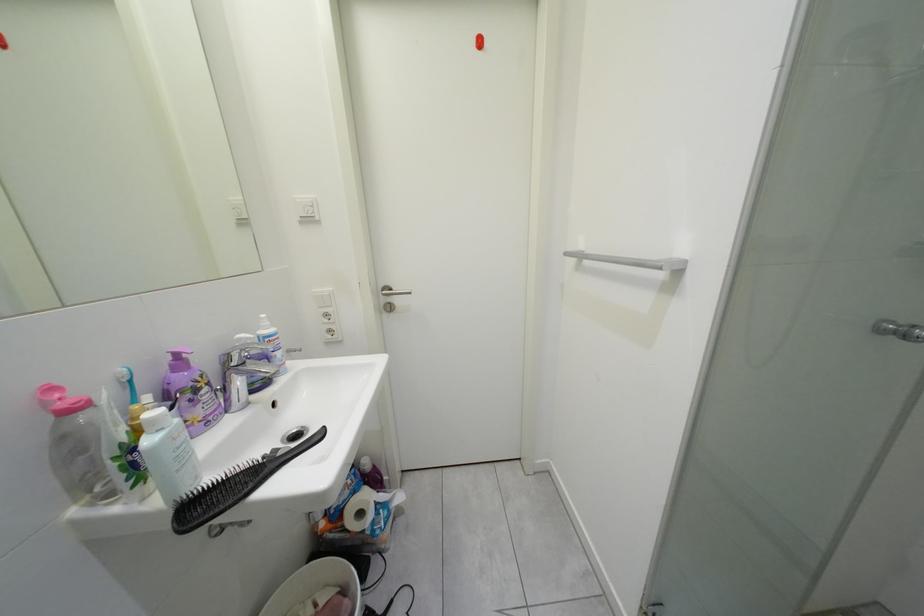
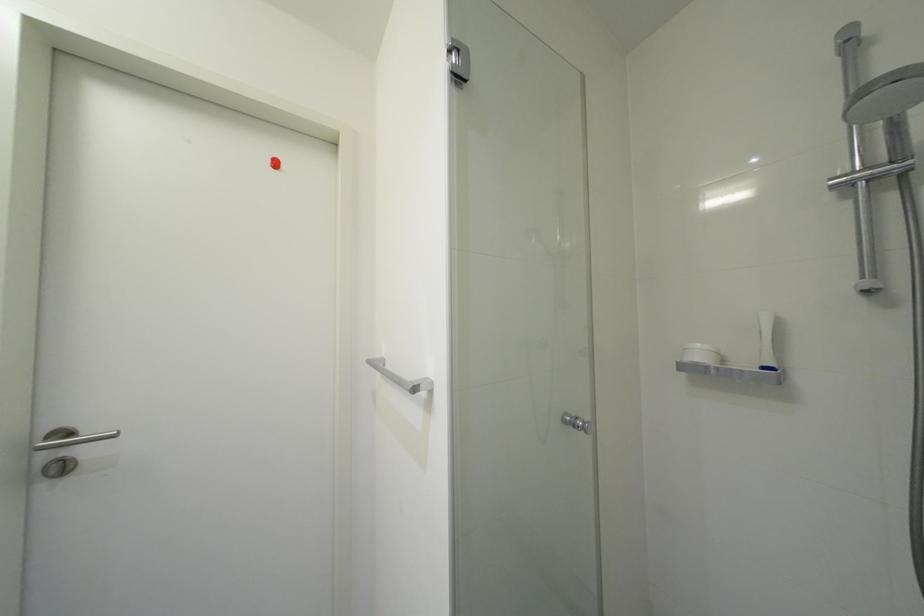
The images are taken continuously from a first-person perspective. In which direction is your viewpoint rotating?

The rotation direction of the camera is right-up.